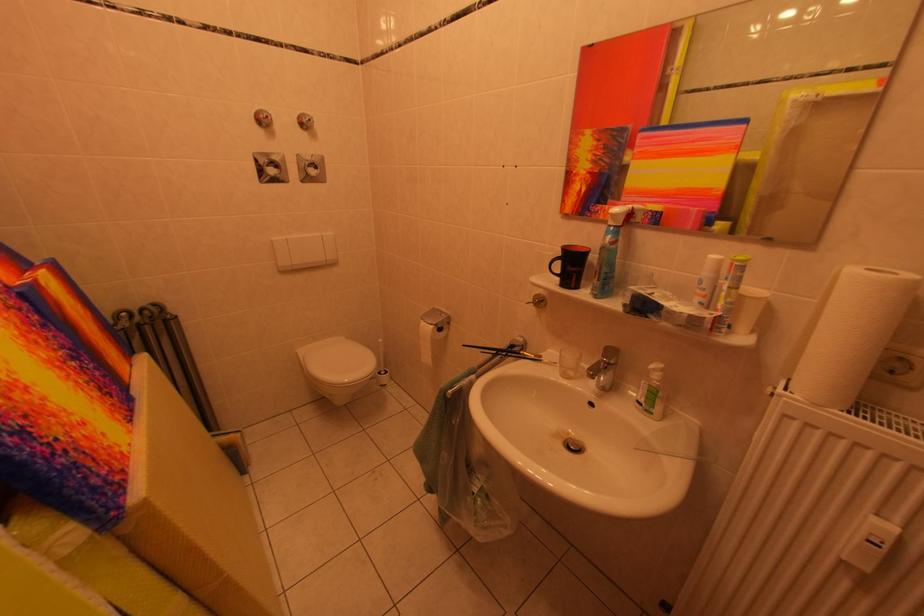
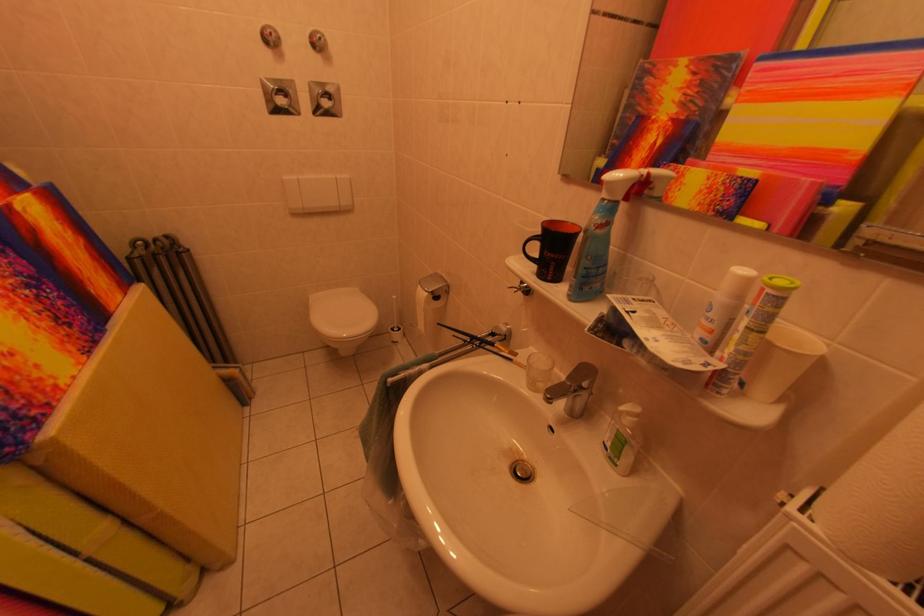
In the second image, find the point that corresponds to pixel 276 120 in the first image.

(278, 39)